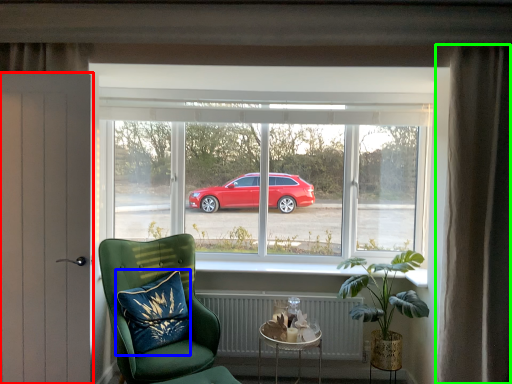
Question: Estimate the real-world distances between objects in this image. Which object is farther from door (highlighted by a red box), pillow (highlighted by a blue box) or curtain (highlighted by a green box)?

Choices:
 (A) pillow
 (B) curtain

Answer: (B)